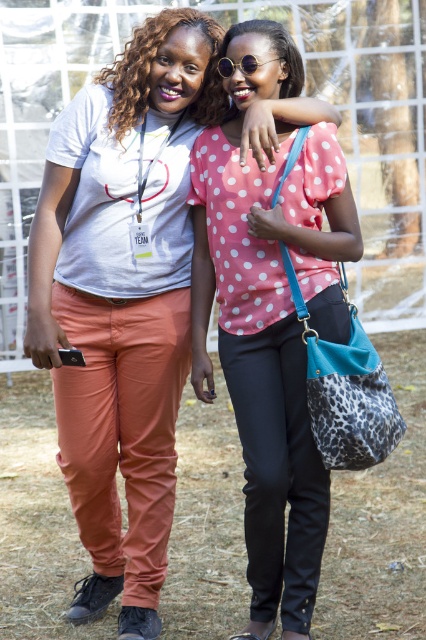
From the picture: You are organizing a photo shoot and need to ensure that the pink dotted blouse at center and sunglasses at center are visible in the frame. Based on their positions, which one should you adjust first to make sure both are fully visible?

The sunglasses at center should be adjusted first because the pink dotted blouse at center is below it, so moving or repositioning the sunglasses might uncover the blouse, ensuring both are visible.

You are standing at the point labeled point (207, 154) and want to walk to the nearest exit, which is 5 meters away. Can you reach the exit without moving more than 5 meters?

The distance between point (207, 154) and the viewer is 4.18 meters. Since the exit is 5 meters away, you can reach it without moving more than 5 meters.